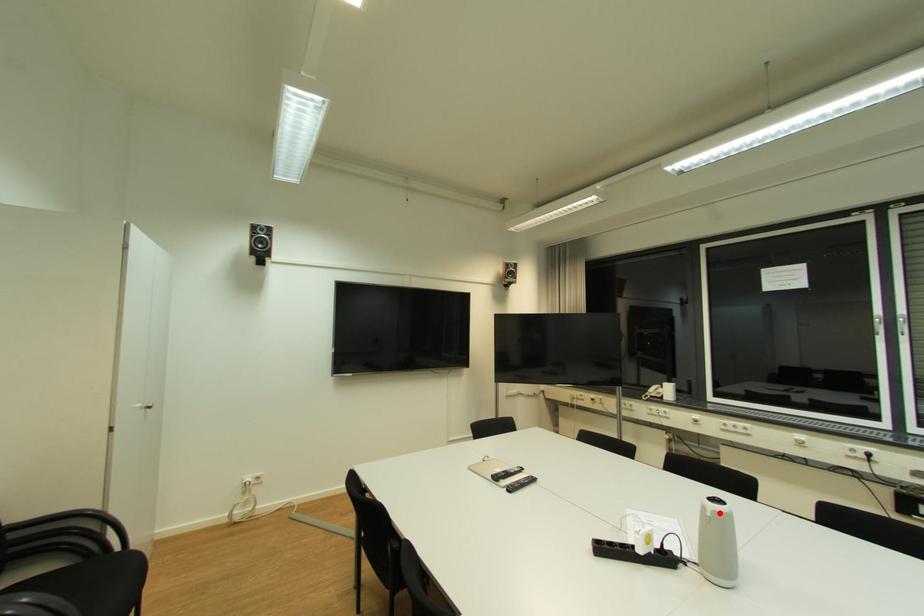
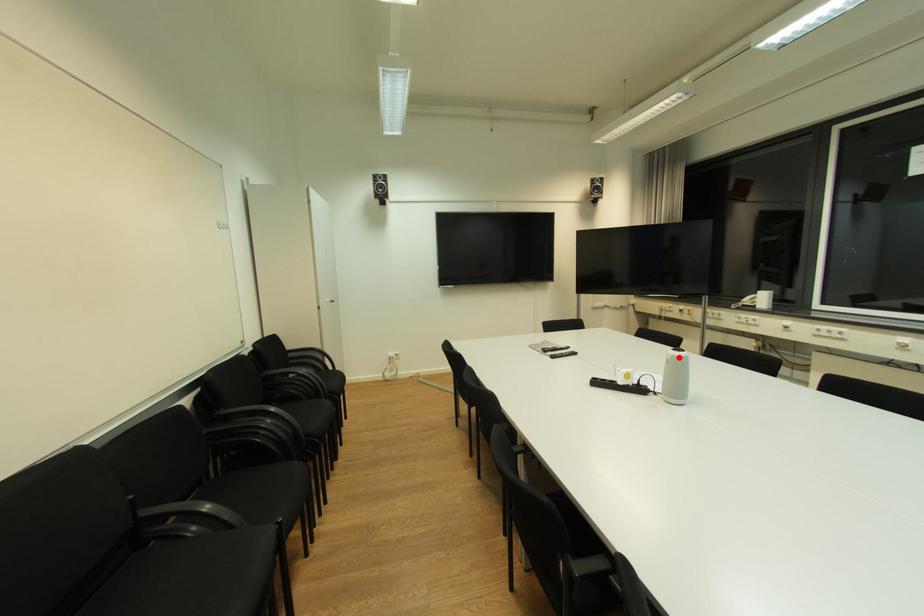
I am providing you with two images of the same scene from different viewpoints. A red point is marked on the first image and another point is marked on the second image. Are the points marked in image1 and image2 representing the same 3D position?

Yes